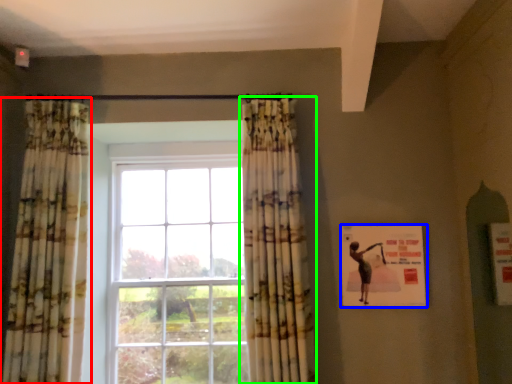
Question: Which is nearer to the curtain (highlighted by a red box)? poster (highlighted by a blue box) or curtain (highlighted by a green box).

Choices:
 (A) poster
 (B) curtain

Answer: (B)